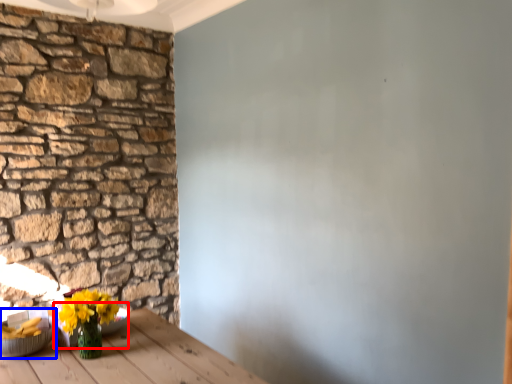
Question: Which object is closer to the camera taking this photo, bowl (highlighted by a red box) or bowl (highlighted by a blue box)?

Choices:
 (A) bowl
 (B) bowl

Answer: (B)